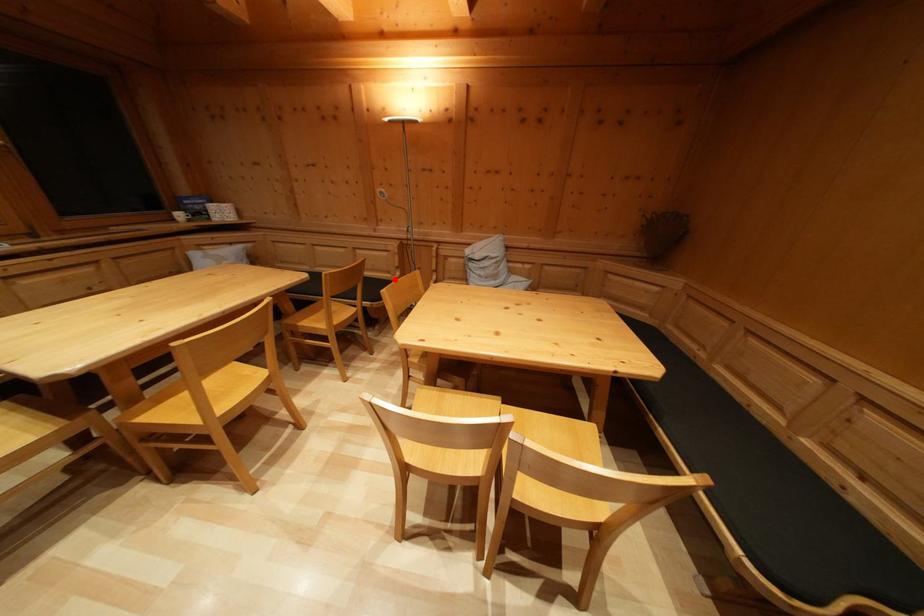
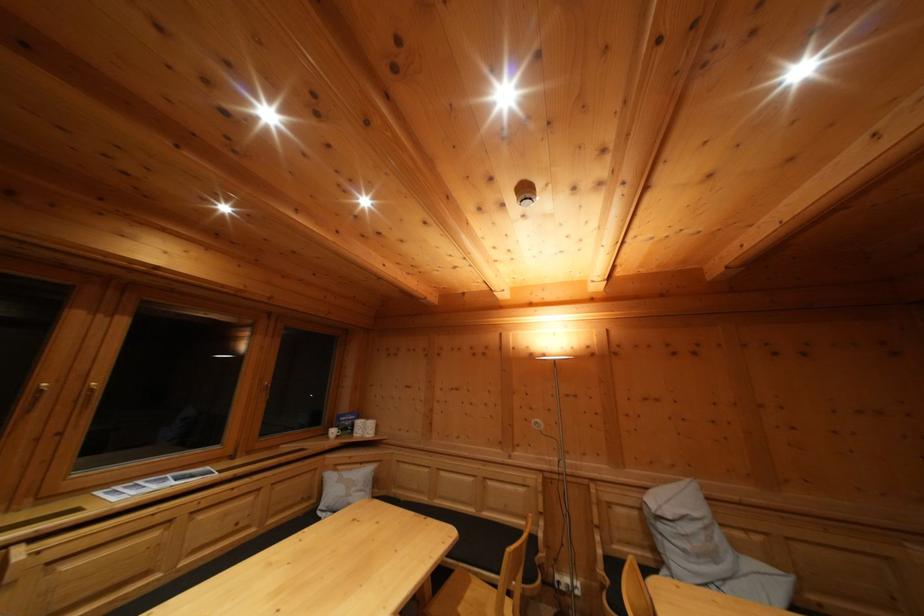
Question: I am providing you with two images of the same scene from different viewpoints. In image1, a red point is highlighted. Considering the same 3D point in image2, which of the following is correct?

Choices:
 (A) It is closer
 (B) It is farther

Answer: (B)